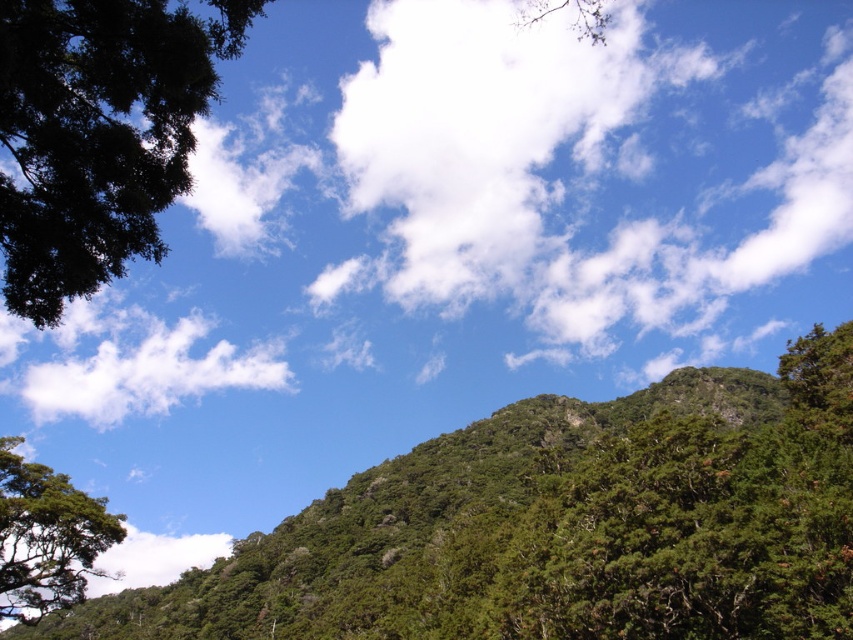
You are an observer looking at the landscape. Which object is positioned to the right of the other between the green leafy hillside at center and the white fluffy cloud at lower left?

The green leafy hillside at center is positioned to the right of the white fluffy cloud at lower left.

You are an airplane passenger looking out the window and see the white fluffy cloud at upper center and the green leafy tree at upper left. Which object is closer to you?

The white fluffy cloud at upper center is closer to you because the green leafy tree at upper left is behind it.